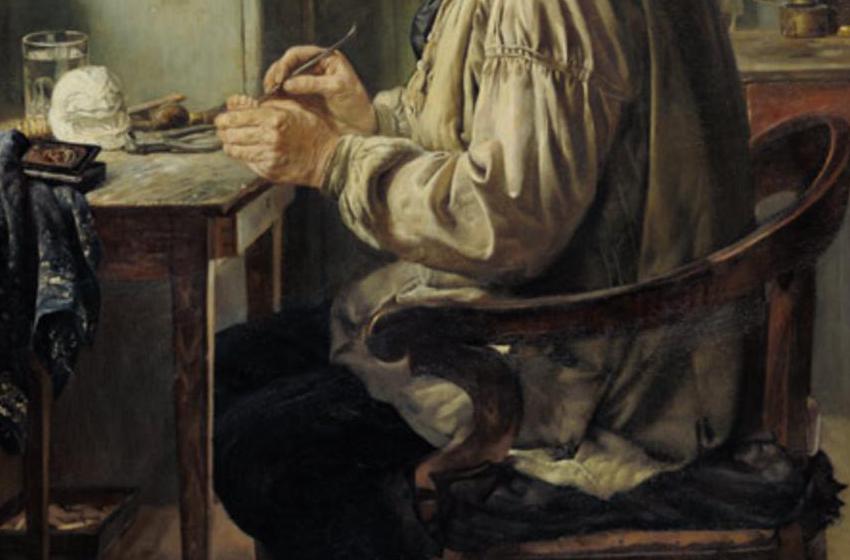
At what (x,y) coordinates should I click in order to perform the action: click on pen. Please return your answer as a coordinate pair (x, y). This screenshot has height=560, width=850. Looking at the image, I should click on (310, 60), (299, 66).